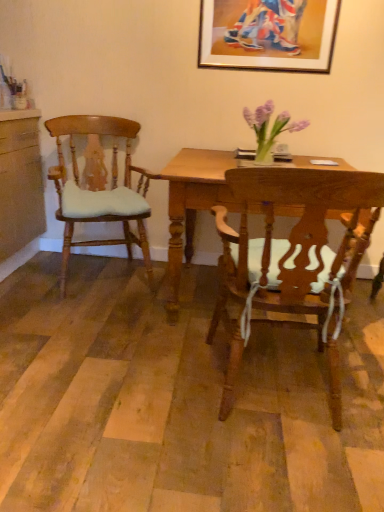
Image resolution: width=384 pixels, height=512 pixels. Describe the element at coordinates (193, 204) in the screenshot. I see `wooden desk at center` at that location.

What is the approximate height of wooden chair at center, marked as the 1th chair in a right-to-left arrangement?

It is 36.25 inches.

In order to face wooden chair at center, arranged as the second chair when viewed from the back, should I rotate leftwards or rightwards?

You should rotate right by 12.316 degrees.

What do you see at coordinates (268, 34) in the screenshot?
I see `wooden picture frame at upper center` at bounding box center [268, 34].

Where is `wooden desk at center`? This screenshot has height=512, width=384. wooden desk at center is located at coordinates (193, 204).

Is wooden picture frame at upper center outside of light brown wood chair at left, placed as the second chair when sorted from right to left?

Indeed, wooden picture frame at upper center is completely outside light brown wood chair at left, placed as the second chair when sorted from right to left.

What's the angular difference between wooden picture frame at upper center and light brown wood chair at left, the 1th chair from the back,'s facing directions?

They differ by 23.4 degrees in their facing directions.

Between wooden picture frame at upper center and light brown wood chair at left, placed as the second chair when sorted from right to left, which one appears on the left side from the viewer's perspective?

light brown wood chair at left, placed as the second chair when sorted from right to left.

Who is smaller, wooden picture frame at upper center or light brown wood chair at left, which appears as the first chair when viewed from the left?

Smaller between the two is wooden picture frame at upper center.

Is light brown wood chair at left, the 1th chair from the back, at the right side of wooden picture frame at upper center?

Incorrect, light brown wood chair at left, the 1th chair from the back, is not on the right side of wooden picture frame at upper center.

Considering the relative positions of light brown wood chair at left, positioned as the second chair in front-to-back order, and wooden picture frame at upper center in the image provided, is light brown wood chair at left, positioned as the second chair in front-to-back order, behind wooden picture frame at upper center?

No, light brown wood chair at left, positioned as the second chair in front-to-back order, is in front of wooden picture frame at upper center.

Is point (50, 121) farther from viewer compared to point (264, 26)?

Yes, it is.

From a real-world perspective, is wooden chair at center, placed as the second chair when sorted from left to right, over light brown wood chair at left, the 1th chair from the back?

No, from a real-world perspective, wooden chair at center, placed as the second chair when sorted from left to right, is not over light brown wood chair at left, the 1th chair from the back

From the image's perspective, who appears lower, wooden chair at center, placed as the second chair when sorted from left to right, or light brown wood chair at left, which appears as the first chair when viewed from the left?

wooden chair at center, placed as the second chair when sorted from left to right, from the image's perspective.

Is wooden chair at center, marked as the 1th chair in a right-to-left arrangement, in front of light brown wood chair at left, positioned as the second chair in front-to-back order?

Yes, the depth of wooden chair at center, marked as the 1th chair in a right-to-left arrangement, is less than that of light brown wood chair at left, positioned as the second chair in front-to-back order.

Which is behind, wooden desk at center or wooden chair at center, arranged as the second chair when viewed from the back?

wooden desk at center is behind.

Does point (171, 191) appear closer or farther from the camera than point (245, 269)?

Point (171, 191) is positioned farther from the camera compared to point (245, 269).

Which is correct: wooden desk at center is inside wooden chair at center, arranged as the second chair when viewed from the back, or outside of it?

wooden desk at center exists outside the volume of wooden chair at center, arranged as the second chair when viewed from the back.

Which object is positioned more to the left, wooden desk at center or wooden chair at center, marked as the 1th chair in a right-to-left arrangement?

Positioned to the left is wooden chair at center, marked as the 1th chair in a right-to-left arrangement.

Considering the points (180, 178) and (244, 57), which point is in front, point (180, 178) or point (244, 57)?

Positioned in front is point (180, 178).

Is wooden picture frame at upper center inside wooden desk at center?

No, wooden picture frame at upper center is located outside of wooden desk at center.

From the picture: Is wooden desk at center aimed at wooden picture frame at upper center?

No, wooden desk at center is not facing towards wooden picture frame at upper center.

Considering the sizes of wooden desk at center and wooden picture frame at upper center in the image, is wooden desk at center taller or shorter than wooden picture frame at upper center?

Considering their sizes, wooden desk at center has more height than wooden picture frame at upper center.

From the picture: From a real-world perspective, which object stands above the other?

From a 3D spatial view, light brown wood chair at left, placed as the second chair when sorted from right to left, is above.

From the picture: Which is correct: light brown wood chair at left, placed as the second chair when sorted from right to left, is inside wooden chair at center, placed as the second chair when sorted from left to right, or outside of it?

light brown wood chair at left, placed as the second chair when sorted from right to left, exists outside the volume of wooden chair at center, placed as the second chair when sorted from left to right.

Is light brown wood chair at left, which appears as the first chair when viewed from the left, far from wooden chair at center, arranged as the second chair when viewed from the back?

Yes, light brown wood chair at left, which appears as the first chair when viewed from the left, is far from wooden chair at center, arranged as the second chair when viewed from the back.

Can you confirm if light brown wood chair at left, positioned as the second chair in front-to-back order, is thinner than wooden chair at center, placed as the second chair when sorted from left to right?

No, light brown wood chair at left, positioned as the second chair in front-to-back order, is not thinner than wooden chair at center, placed as the second chair when sorted from left to right.

Is light brown wood chair at left, the 1th chair from the back, placed right next to wooden desk at center?

No.

Which is correct: light brown wood chair at left, positioned as the second chair in front-to-back order, is inside wooden desk at center, or outside of it?

light brown wood chair at left, positioned as the second chair in front-to-back order, is spatially situated outside wooden desk at center.

In the scene shown: Does light brown wood chair at left, the 1th chair from the back, have a larger size compared to wooden desk at center?

Actually, light brown wood chair at left, the 1th chair from the back, might be smaller than wooden desk at center.

Where is `picture frame on the right of light brown wood chair at left, which appears as the first chair when viewed from the left`? The image size is (384, 512). picture frame on the right of light brown wood chair at left, which appears as the first chair when viewed from the left is located at coordinates (268, 34).

Identify the location of picture frame that is above the light brown wood chair at left, which appears as the first chair when viewed from the left (from the image's perspective). This screenshot has width=384, height=512. (268, 34).

When comparing their distances from wooden picture frame at upper center, does wooden desk at center or light brown wood chair at left, the 1th chair from the back, seem closer?

Based on the image, wooden desk at center appears to be nearer to wooden picture frame at upper center.

Looking at the image, which one is located further to wooden picture frame at upper center, wooden chair at center, marked as the 1th chair in a right-to-left arrangement, or wooden desk at center?

The object further to wooden picture frame at upper center is wooden chair at center, marked as the 1th chair in a right-to-left arrangement.

Looking at this image, estimate the real-world distances between objects in this image. Which object is further from wooden desk at center, wooden chair at center, marked as the 1th chair in a right-to-left arrangement, or wooden picture frame at upper center?

wooden picture frame at upper center lies further to wooden desk at center than the other object.

Based on their spatial positions, is light brown wood chair at left, which appears as the first chair when viewed from the left, or wooden picture frame at upper center closer to wooden chair at center, the 1th chair when ordered from front to back?

light brown wood chair at left, which appears as the first chair when viewed from the left, lies closer to wooden chair at center, the 1th chair when ordered from front to back, than the other object.

Looking at this image, estimate the real-world distances between objects in this image. Which object is closer to light brown wood chair at left, which appears as the first chair when viewed from the left, wooden chair at center, arranged as the second chair when viewed from the back, or wooden desk at center?

The object closer to light brown wood chair at left, which appears as the first chair when viewed from the left, is wooden desk at center.

Considering their positions, is wooden picture frame at upper center positioned further to light brown wood chair at left, positioned as the second chair in front-to-back order, than wooden desk at center?

wooden picture frame at upper center lies further to light brown wood chair at left, positioned as the second chair in front-to-back order, than the other object.

Considering their positions, is wooden desk at center positioned further to light brown wood chair at left, positioned as the second chair in front-to-back order, than wooden chair at center, arranged as the second chair when viewed from the back?

The object further to light brown wood chair at left, positioned as the second chair in front-to-back order, is wooden chair at center, arranged as the second chair when viewed from the back.

Looking at the image, which one is located closer to wooden picture frame at upper center, light brown wood chair at left, the 1th chair from the back, or wooden desk at center?

Based on the image, wooden desk at center appears to be nearer to wooden picture frame at upper center.

This screenshot has width=384, height=512. What are the coordinates of `chair between wooden picture frame at upper center and wooden chair at center, marked as the 1th chair in a right-to-left arrangement, in the up-down direction` in the screenshot? It's located at (100, 191).

This screenshot has width=384, height=512. Find the location of `desk between wooden picture frame at upper center and wooden chair at center, the 1th chair when ordered from front to back, from top to bottom`. desk between wooden picture frame at upper center and wooden chair at center, the 1th chair when ordered from front to back, from top to bottom is located at coordinates (193, 204).

This screenshot has width=384, height=512. In order to click on chair that lies between wooden picture frame at upper center and wooden desk at center from top to bottom in this screenshot , I will do `click(100, 191)`.

Locate an element on the screen. This screenshot has height=512, width=384. chair between light brown wood chair at left, the 1th chair from the back, and wooden desk at center is located at coordinates (296, 251).